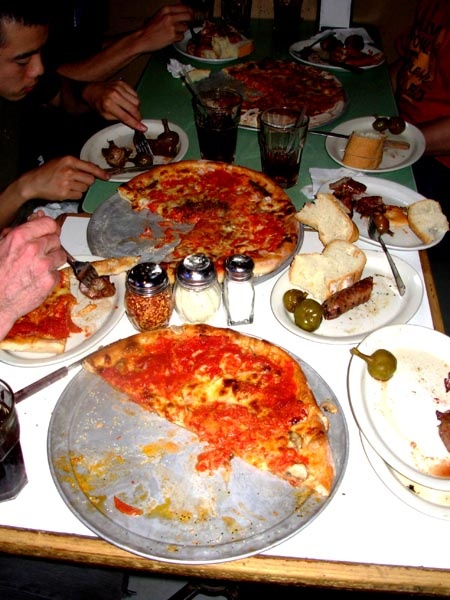
At what (x,y) coordinates should I click in order to perform the action: click on salt shaker. Please return your answer as a coordinate pair (x, y). The width and height of the screenshot is (450, 600). Looking at the image, I should click on (240, 291).